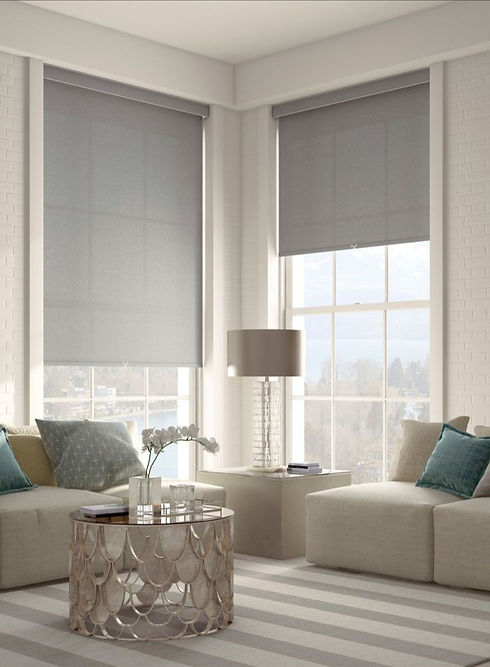
At what (x,y) coordinates should I click in order to perform the action: click on corner. Please return your answer as a coordinate pair (x, y). The width and height of the screenshot is (490, 667). Looking at the image, I should click on (240, 295).